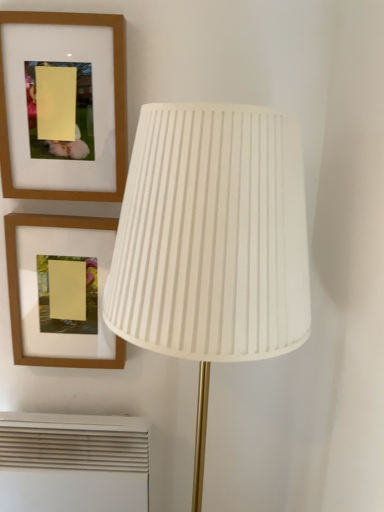
Question: In the image, is wooden picture frame at upper left, arranged as the second picture frame when viewed from the top, positioned in front of or behind white pleated fabric lampshade at center?

Choices:
 (A) front
 (B) behind

Answer: (B)

Question: Is wooden picture frame at upper left, the first picture frame in the bottom-to-top sequence, taller or shorter than white pleated fabric lampshade at center?

Choices:
 (A) tall
 (B) short

Answer: (B)

Question: Estimate the real-world distances between objects in this image. Which object is closer to the white pleated fabric lampshade at center?

Choices:
 (A) wooden frame at upper left, which ranks as the second picture frame in bottom-to-top order
 (B) wooden picture frame at upper left, the first picture frame in the bottom-to-top sequence
 (C) white plastic air conditioner at lower left

Answer: (A)

Question: Estimate the real-world distances between objects in this image. Which object is closer to the wooden frame at upper left, which ranks as the second picture frame in bottom-to-top order?

Choices:
 (A) white pleated fabric lampshade at center
 (B) wooden picture frame at upper left, arranged as the second picture frame when viewed from the top
 (C) white plastic air conditioner at lower left

Answer: (B)